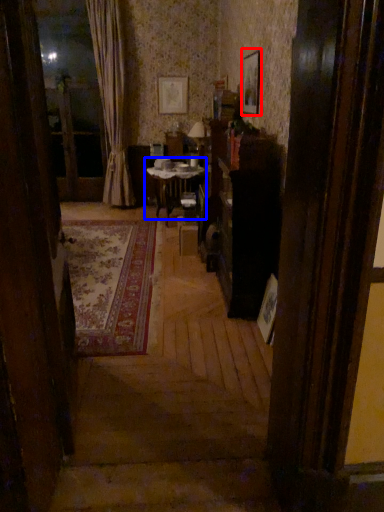
Question: Which object appears closest to the camera in this image, picture frame (highlighted by a red box) or table (highlighted by a blue box)?

Choices:
 (A) picture frame
 (B) table

Answer: (A)